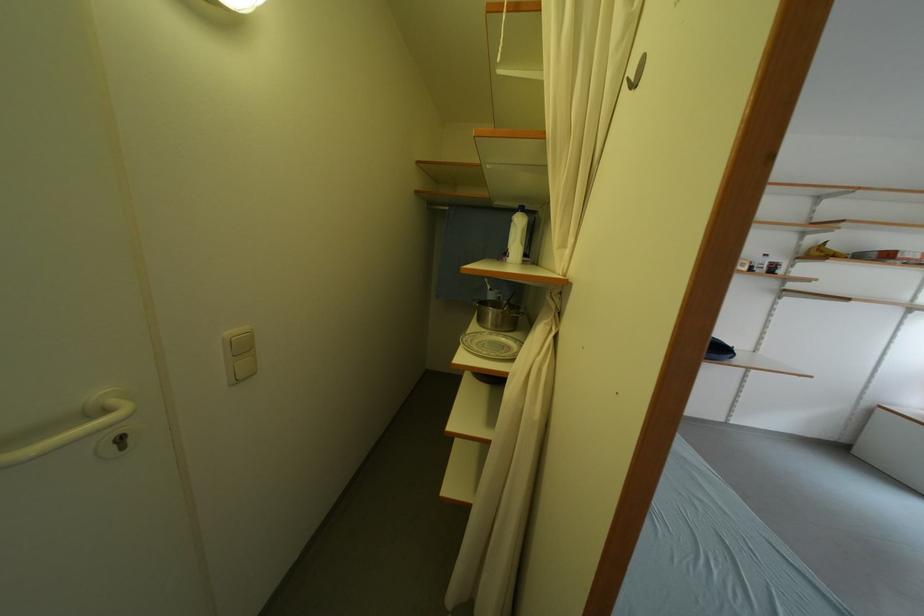
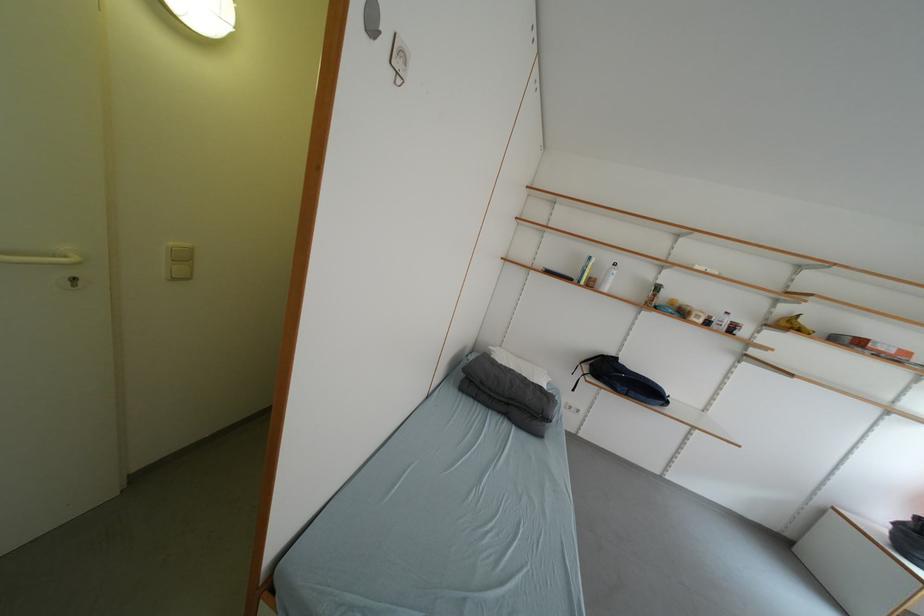
Question: Which direction would the cameraman need to move to produce the second image? Reply with the corresponding letter.

Choices:
 (A) Left
 (B) Right
 (C) Forward
 (D) Backward

Answer: (B)